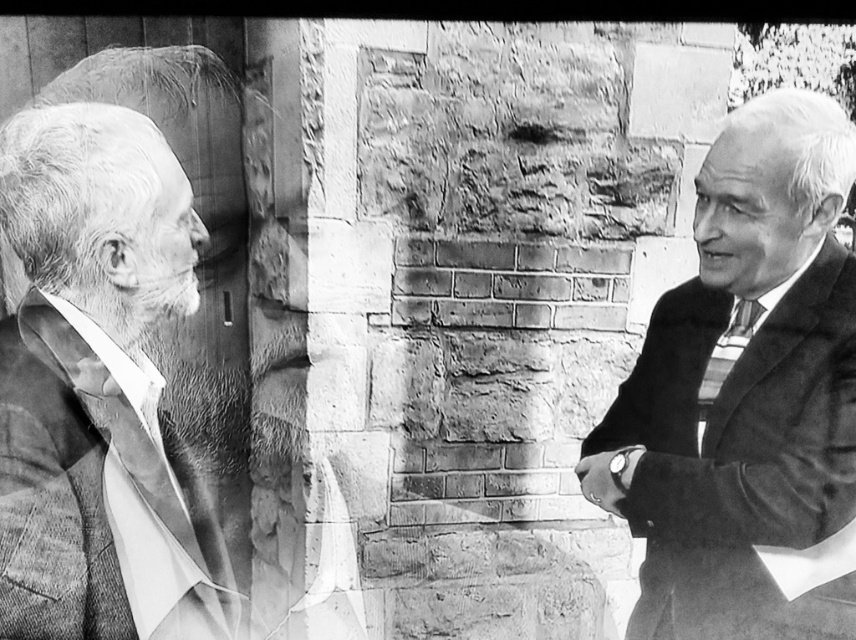
Question: Which object is positioned closest to the gray wool suit at left?

Choices:
 (A) silky black tie at right
 (B) smooth suit jacket at right

Answer: (B)

Question: Does gray wool suit at left have a smaller size compared to silky black tie at right?

Choices:
 (A) yes
 (B) no

Answer: (B)

Question: Considering the real-world distances, which object is closest to the gray wool suit at left?

Choices:
 (A) smooth suit jacket at right
 (B) silky black tie at right

Answer: (A)

Question: Does gray wool suit at left appear on the right side of silky black tie at right?

Choices:
 (A) yes
 (B) no

Answer: (B)

Question: In this image, where is gray wool suit at left located relative to silky black tie at right?

Choices:
 (A) below
 (B) above

Answer: (A)

Question: Among these objects, which one is farthest from the camera?

Choices:
 (A) silky black tie at right
 (B) gray wool suit at left
 (C) smooth suit jacket at right

Answer: (A)